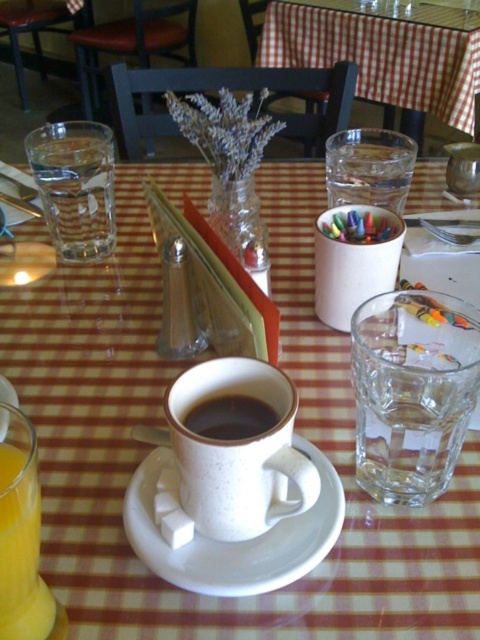
Does speckled ceramic mug at center appear under black matte cup at center?

Correct, speckled ceramic mug at center is located below black matte cup at center.

This screenshot has height=640, width=480. I want to click on speckled ceramic mug at center, so click(x=237, y=449).

You are a GUI agent. You are given a task and a screenshot of the screen. Output one action in this format:
    pyautogui.click(x=<x>, y=<y>)
    Task: Click on the speckled ceramic mug at center
    The height and width of the screenshot is (640, 480).
    Given the screenshot: What is the action you would take?
    pyautogui.click(x=237, y=449)

Is white speckled saucer at center positioned in front of black matte cup at center?

Yes.

Is point (316, 536) positioned after point (223, 426)?

Yes, it is.

You are a GUI agent. You are given a task and a screenshot of the screen. Output one action in this format:
    pyautogui.click(x=<x>, y=<y>)
    Task: Click on the white speckled saucer at center
    The width and height of the screenshot is (480, 640).
    Given the screenshot: What is the action you would take?
    pyautogui.click(x=236, y=541)

Which is above, white speckled saucer at center or translucent glass of orange juice at lower left?

translucent glass of orange juice at lower left is higher up.

Does point (202, 564) come in front of point (22, 621)?

No, it is behind (22, 621).

What do you see at coordinates (236, 541) in the screenshot? I see `white speckled saucer at center` at bounding box center [236, 541].

Find the location of `white speckled saucer at center`. white speckled saucer at center is located at coordinates (236, 541).